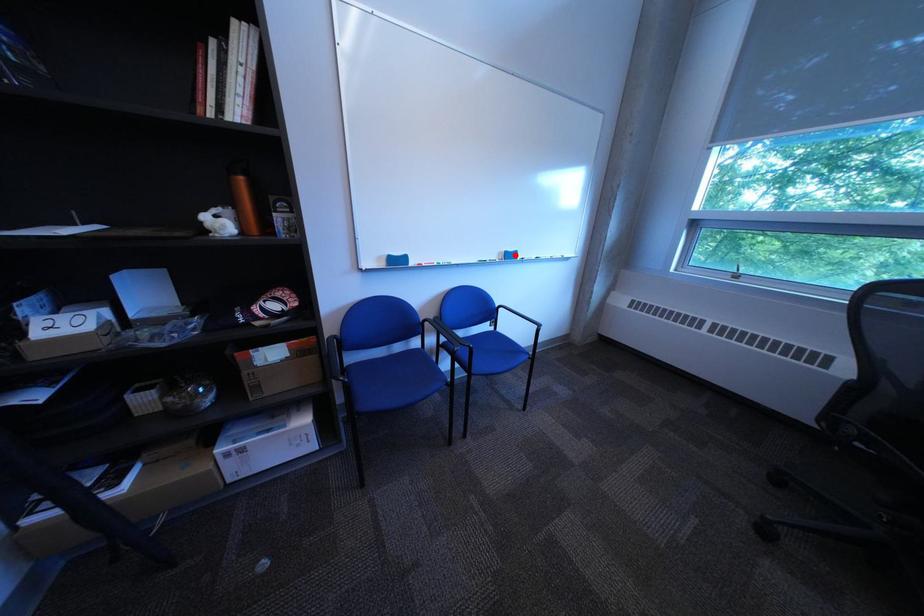
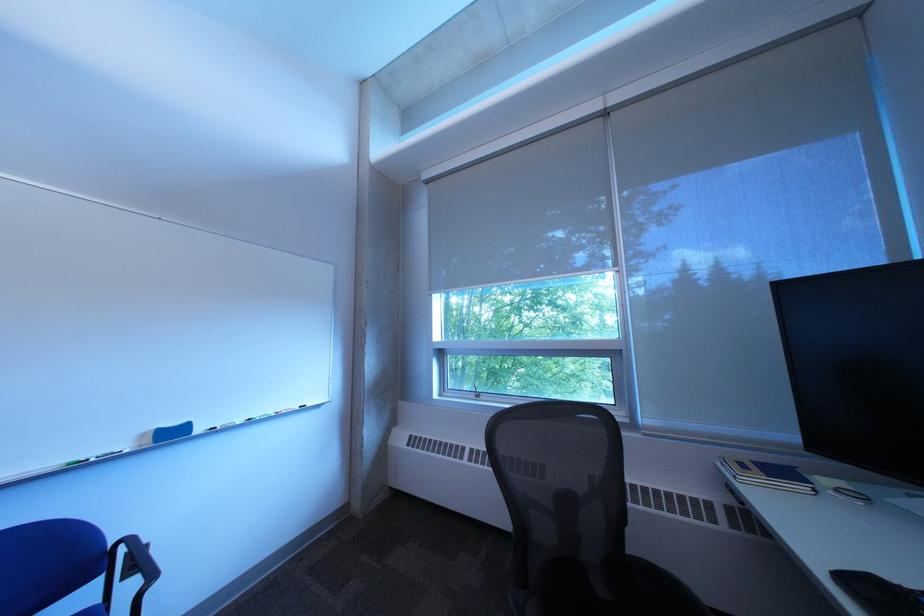
In the second image, find the point that corresponds to the highlighted location in the first image.

(159, 437)